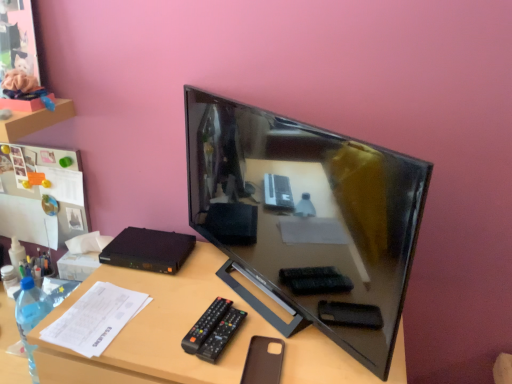
Find the location of a particular element. free space that is in between black plastic remote at lower center and brown leather phone case at lower center is located at coordinates (239, 350).